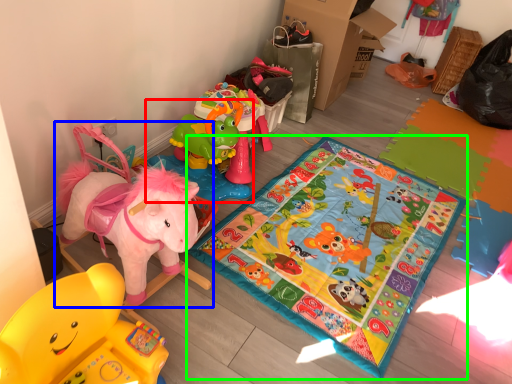
Question: Which object is the farthest from toy (highlighted by a red box)? Choose among these: toy (highlighted by a blue box) or yoga mat (highlighted by a green box).

Choices:
 (A) toy
 (B) yoga mat

Answer: (A)